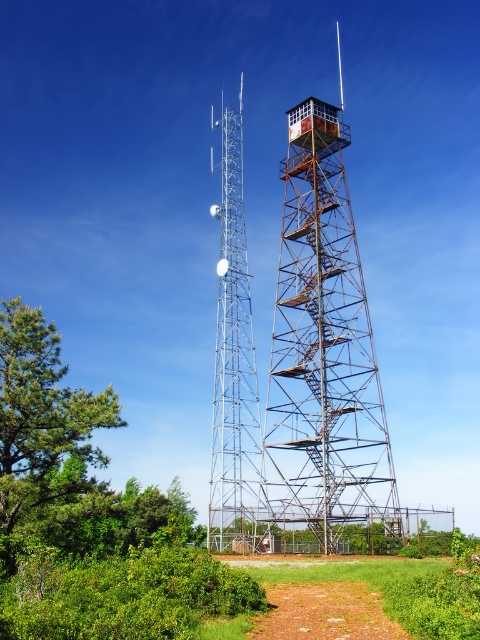
Is silver metallic tower at center positioned before brown dirt path at lower center?

That is False.

Does silver metallic tower at center have a lesser height compared to brown dirt path at lower center?

No, silver metallic tower at center is not shorter than brown dirt path at lower center.

Where is `silver metallic tower at center`? silver metallic tower at center is located at coordinates (232, 362).

This screenshot has width=480, height=640. I want to click on silver metallic tower at center, so click(232, 362).

What do you see at coordinates (320, 364) in the screenshot? I see `rusty metal fire tower at center` at bounding box center [320, 364].

Does point (376, 394) lie in front of point (224, 461)?

Yes, point (376, 394) is closer to viewer.

What do you see at coordinates (320, 364) in the screenshot?
I see `rusty metal fire tower at center` at bounding box center [320, 364].

Locate an element on the screen. rusty metal fire tower at center is located at coordinates (320, 364).

How far apart are rusty metal fire tower at center and brown dirt path at lower center?

rusty metal fire tower at center and brown dirt path at lower center are 78.89 feet apart from each other.

Between point (360, 460) and point (343, 621), which one is positioned behind?

The point (360, 460) is behind.

Locate an element on the screen. Image resolution: width=480 pixels, height=640 pixels. rusty metal fire tower at center is located at coordinates (320, 364).

Identify the location of rusty metal fire tower at center. (320, 364).